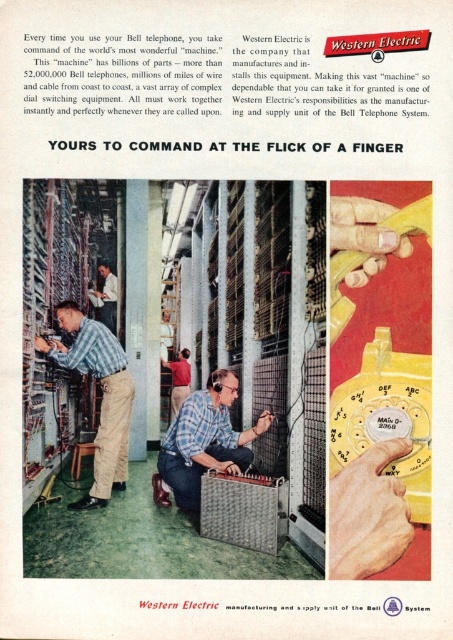
Is blue plaid shirt at center to the right of red shirt at center from the viewer's perspective?

Correct, you'll find blue plaid shirt at center to the right of red shirt at center.

Can you confirm if blue plaid shirt at center is bigger than red shirt at center?

Indeed, blue plaid shirt at center has a larger size compared to red shirt at center.

Does point (218, 428) lie behind point (172, 412)?

No.

I want to click on blue plaid shirt at center, so click(203, 442).

Does matte blue shirt at center lie behind red shirt at center?

No, matte blue shirt at center is closer to the viewer.

Does matte blue shirt at center have a lesser height compared to red shirt at center?

No.

What do you see at coordinates (101, 396) in the screenshot? This screenshot has height=640, width=453. I see `matte blue shirt at center` at bounding box center [101, 396].

Identify the location of matte blue shirt at center. The width and height of the screenshot is (453, 640). (101, 396).

Which is more to the right, blue plaid shirt at center or matte blue shirt at center?

blue plaid shirt at center

Does blue plaid shirt at center lie in front of matte blue shirt at center?

Yes, it is in front of matte blue shirt at center.

Between point (186, 509) and point (124, 390), which one is positioned behind?

The point (124, 390) is more distant.

Image resolution: width=453 pixels, height=640 pixels. Identify the location of blue plaid shirt at center. (203, 442).